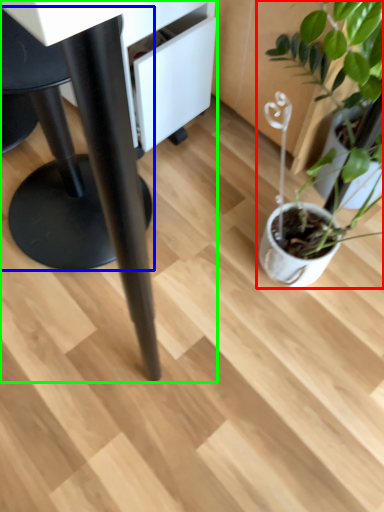
Question: Estimate the real-world distances between objects in this image. Which object is closer to houseplant (highlighted by a red box), swivel chair (highlighted by a blue box) or table (highlighted by a green box)?

Choices:
 (A) swivel chair
 (B) table

Answer: (B)